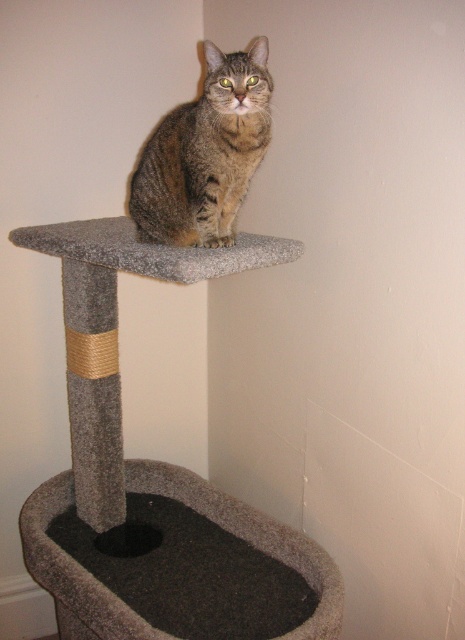
You are a small toy mouse that wants to jump from the dark gray carpeted cat bed at lower center to the tabby fur cat at center. Can you reach the cat?

The tabby fur cat at center is much taller than the dark gray carpeted cat bed at lower center, so the toy mouse cannot reach the cat from the bed.

You are a cat owner who wants to place a new toy on the floor between the tabby fur cat at center and the dark gray carpeted cat bed at lower center. The toy requires a minimum of 30 inches of space to be placed safely. Can you determine if there is enough space between them?

The tabby fur cat at center and dark gray carpeted cat bed at lower center are 31.11 inches apart from each other. Since 31.11 inches is more than the required 30 inches, there is enough space to place the toy safely between them.